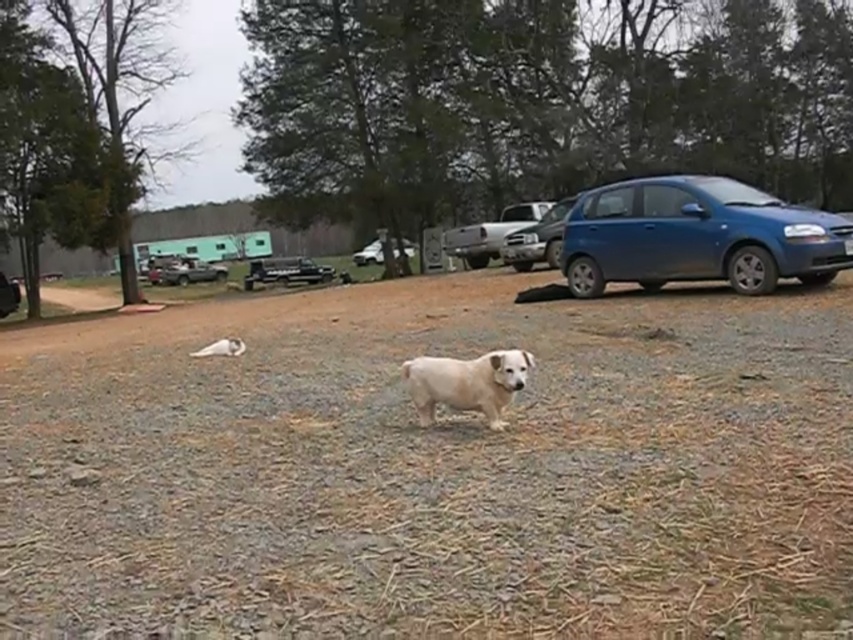
The image size is (853, 640). What do you see at coordinates (537, 237) in the screenshot?
I see `metallic blue sedan at center right` at bounding box center [537, 237].

Can you confirm if metallic blue sedan at center right is wider than metallic silver truck at center?

Indeed, metallic blue sedan at center right has a greater width compared to metallic silver truck at center.

Is point (524, 230) more distant than point (206, 280)?

No, (524, 230) is in front of (206, 280).

This screenshot has width=853, height=640. Find the location of `metallic blue sedan at center right`. metallic blue sedan at center right is located at coordinates point(537,237).

In the scene shown: Between metallic silver truck at center and white matte car at center, which one appears on the left side from the viewer's perspective?

metallic silver truck at center is more to the left.

Who is lower down, metallic silver truck at center or white matte car at center?

metallic silver truck at center is lower down.

Is point (177, 266) positioned after point (393, 252)?

Yes, point (177, 266) is behind point (393, 252).

At what (x,y) coordinates should I click in order to perform the action: click on metallic silver truck at center. Please return your answer as a coordinate pair (x, y). Image resolution: width=853 pixels, height=640 pixels. Looking at the image, I should click on (184, 269).

Which is above, blue metallic car at right or metallic blue sedan at center right?

metallic blue sedan at center right

Is point (679, 257) positioned in front of point (527, 230)?

Yes.

Locate an element on the screen. blue metallic car at right is located at coordinates (697, 236).